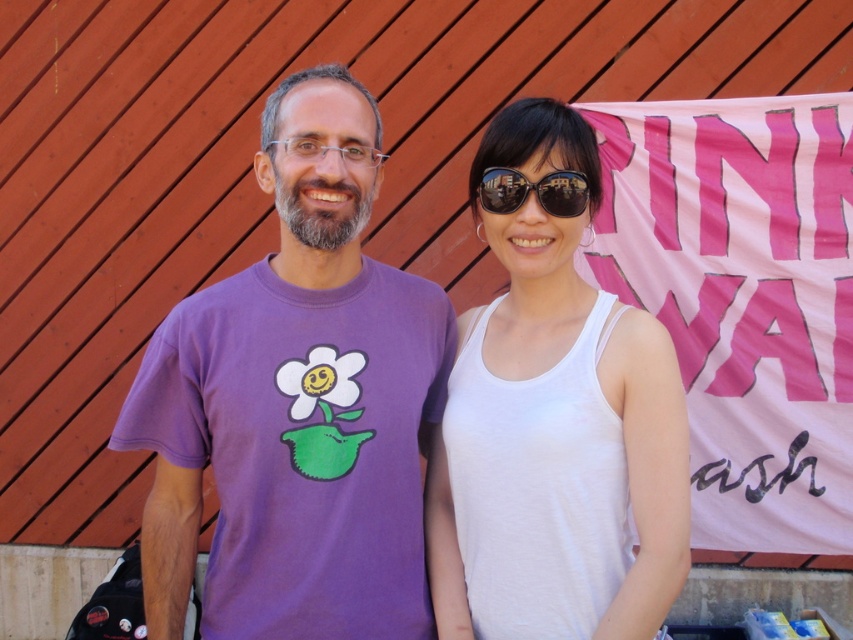
Is point (419, 547) farther from camera compared to point (564, 204)?

That is True.

Which is below, purple cotton t-shirt at left or sunglasses at center?

Positioned lower is purple cotton t-shirt at left.

Is point (317, 461) closer to viewer compared to point (576, 209)?

Yes, point (317, 461) is closer to viewer.

I want to click on purple cotton t-shirt at left, so click(297, 404).

Describe the element at coordinates (297, 404) in the screenshot. I see `purple cotton t-shirt at left` at that location.

Between purple cotton t-shirt at left and white cotton tank top at center, which one appears on the right side from the viewer's perspective?

white cotton tank top at center is more to the right.

This screenshot has width=853, height=640. What do you see at coordinates (297, 404) in the screenshot? I see `purple cotton t-shirt at left` at bounding box center [297, 404].

Find the location of a particular element. The height and width of the screenshot is (640, 853). purple cotton t-shirt at left is located at coordinates (297, 404).

Is point (592, 611) positioned after point (540, 202)?

That is False.

Is white cotton tank top at center bigger than sunglasses at center?

Yes, white cotton tank top at center is bigger than sunglasses at center.

Who is more distant from viewer, [442,518] or [561,193]?

The point [442,518] is more distant.

This screenshot has height=640, width=853. I want to click on white cotton tank top at center, so click(572, 426).